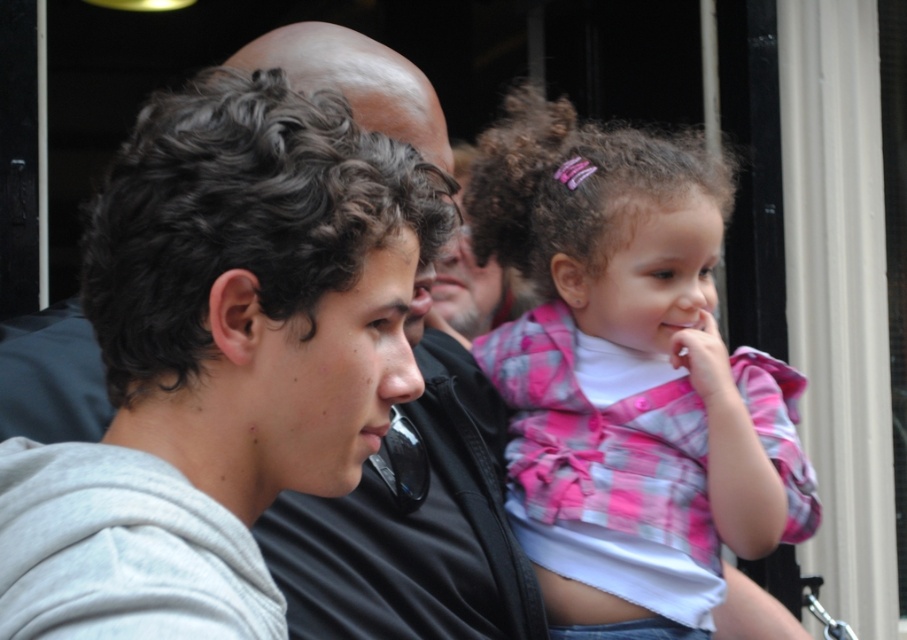
Which is in front, point (580, 208) or point (327, 556)?

Positioned in front is point (327, 556).

Does point (562, 522) lie behind point (361, 36)?

That is True.

Between point (603, 241) and point (278, 29), which one is positioned in front?

Point (278, 29)

In order to click on pink plaid shirt at center in this screenshot , I will do `click(628, 376)`.